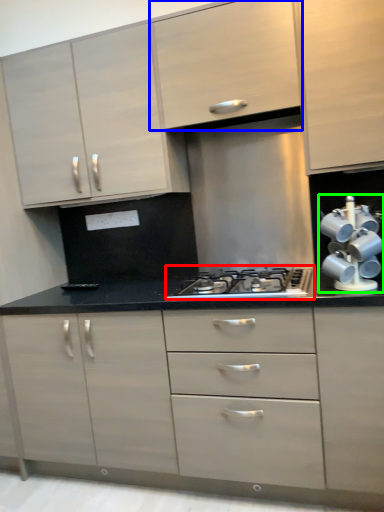
Question: Which is farther away from gas stove (highlighted by a red box)? cabinetry (highlighted by a blue box) or appliance (highlighted by a green box)?

Choices:
 (A) cabinetry
 (B) appliance

Answer: (A)